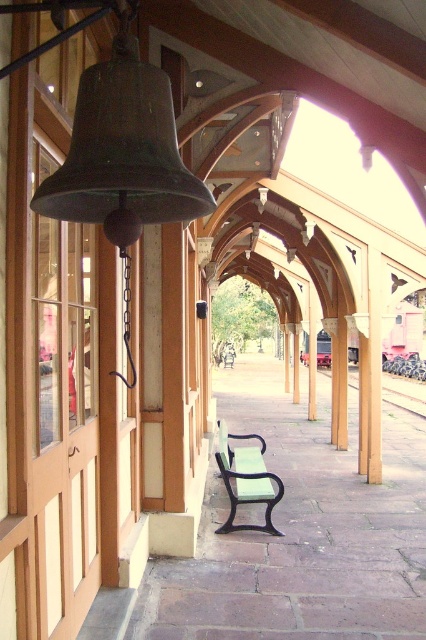
Is point (253, 486) farther from viewer compared to point (388, 374)?

That is False.

Can you confirm if green matte bench at center is positioned to the right of metal train track at center?

In fact, green matte bench at center is to the left of metal train track at center.

Who is more forward, (273, 484) or (417, 404)?

Positioned in front is point (273, 484).

Where is `green matte bench at center`? The image size is (426, 640). green matte bench at center is located at coordinates (247, 480).